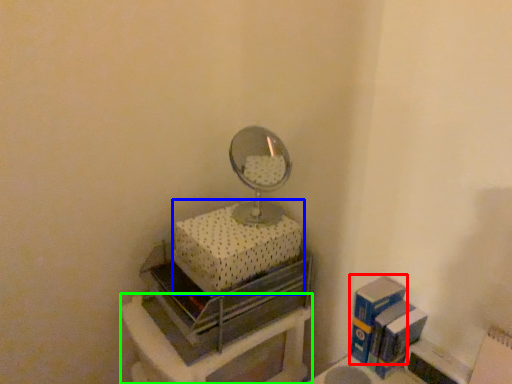
Question: Considering the real-world distances, which object is closest to box (highlighted by a red box)? box (highlighted by a blue box) or furniture (highlighted by a green box).

Choices:
 (A) box
 (B) furniture

Answer: (B)